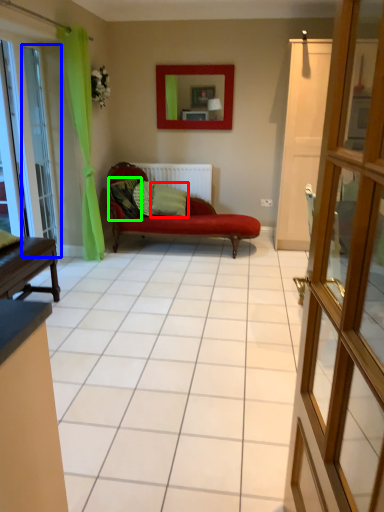
Question: Which is nearer to the pillow (highlighted by a red box)? glass door (highlighted by a blue box) or pillow (highlighted by a green box).

Choices:
 (A) glass door
 (B) pillow

Answer: (B)